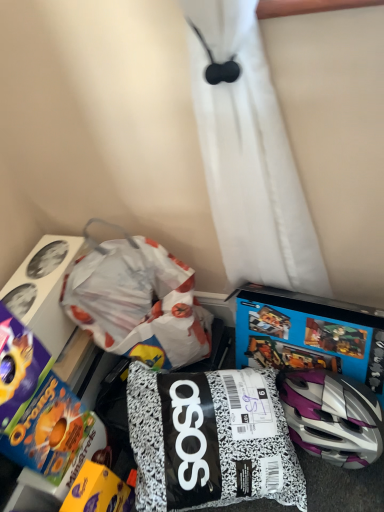
Question: Is white paper bag at center positioned with its back to blue cardboard cereal box at lower left, positioned as the third toy in right-to-left order?

Choices:
 (A) yes
 (B) no

Answer: (B)

Question: Is white paper bag at center taller than blue cardboard cereal box at lower left, the 1th toy when ordered from left to right?

Choices:
 (A) no
 (B) yes

Answer: (B)

Question: Does white paper bag at center have a greater width compared to blue cardboard cereal box at lower left, the 1th toy when ordered from left to right?

Choices:
 (A) yes
 (B) no

Answer: (A)

Question: Considering the relative sizes of white paper bag at center and blue cardboard cereal box at lower left, the 1th toy when ordered from left to right, in the image provided, is white paper bag at center shorter than blue cardboard cereal box at lower left, the 1th toy when ordered from left to right,?

Choices:
 (A) no
 (B) yes

Answer: (A)

Question: Are white paper bag at center and blue cardboard cereal box at lower left, the 1th toy when ordered from left to right, located far from each other?

Choices:
 (A) no
 (B) yes

Answer: (A)

Question: From a real-world perspective, is yellow matte chocolate bar at lower left, positioned as the second toy in right-to-left order, physically located above or below black and white speckled bag at center, which is the 1th toy in right-to-left order?

Choices:
 (A) above
 (B) below

Answer: (B)

Question: Based on their positions, is yellow matte chocolate bar at lower left, positioned as the second toy in right-to-left order, located to the left or right of black and white speckled bag at center, which is counted as the 3th toy, starting from the left?

Choices:
 (A) right
 (B) left

Answer: (B)

Question: Is yellow matte chocolate bar at lower left, marked as the 2th toy in a left-to-right arrangement, in front of or behind black and white speckled bag at center, which is the 1th toy in right-to-left order, in the image?

Choices:
 (A) behind
 (B) front

Answer: (A)

Question: In terms of height, does yellow matte chocolate bar at lower left, positioned as the second toy in right-to-left order, look taller or shorter compared to black and white speckled bag at center, which is the 1th toy in right-to-left order?

Choices:
 (A) short
 (B) tall

Answer: (A)

Question: Considering their positions, is yellow matte chocolate bar at lower left, marked as the 2th toy in a left-to-right arrangement, located in front of or behind white paper bag at center?

Choices:
 (A) behind
 (B) front

Answer: (B)

Question: Which is correct: yellow matte chocolate bar at lower left, marked as the 2th toy in a left-to-right arrangement, is inside white paper bag at center, or outside of it?

Choices:
 (A) inside
 (B) outside

Answer: (B)

Question: From the image's perspective, is yellow matte chocolate bar at lower left, marked as the 2th toy in a left-to-right arrangement, positioned above or below white paper bag at center?

Choices:
 (A) above
 (B) below

Answer: (B)

Question: Is point (91, 480) closer or farther from the camera than point (112, 305)?

Choices:
 (A) closer
 (B) farther

Answer: (A)

Question: Does point (119, 297) appear closer or farther from the camera than point (89, 489)?

Choices:
 (A) farther
 (B) closer

Answer: (A)

Question: In terms of height, does white paper bag at center look taller or shorter compared to yellow matte chocolate bar at lower left, marked as the 2th toy in a left-to-right arrangement?

Choices:
 (A) tall
 (B) short

Answer: (A)